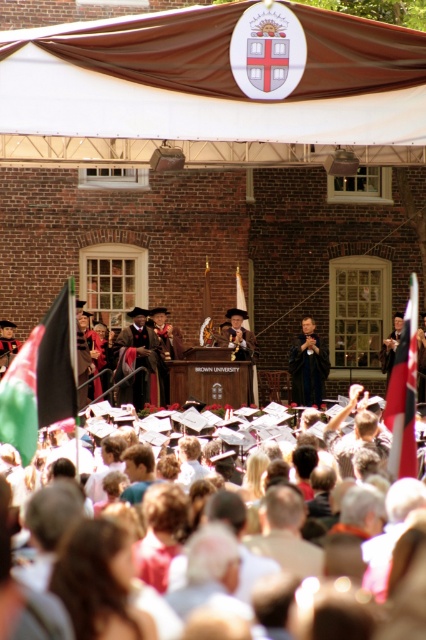
You are a photographer at the graduation ceremony. You want to capture a photo that includes both the green fabric flag at left and the red fabric flag at center. Which flag will appear closer to the camera in the photo?

The green fabric flag at left will appear closer to the camera in the photo because it is in front of the red fabric flag at center.

You are a photographer at the graduation ceremony. You need to capture a photo that includes both the green fabric flag at left and the red fabric flag at center. Based on their positions, which flag should you ensure is positioned closer to the left edge of the frame?

The green fabric flag at left is to the left of the red fabric flag at center, so you should ensure the green fabric flag at left is positioned closer to the left edge of the frame to include both in the photo.